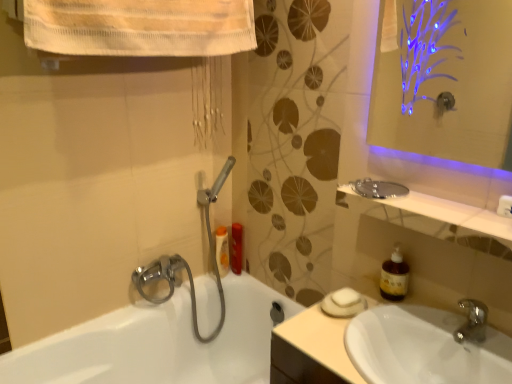
Where is `vacant region in front of white matte soap at sink`? The image size is (512, 384). vacant region in front of white matte soap at sink is located at coordinates (342, 339).